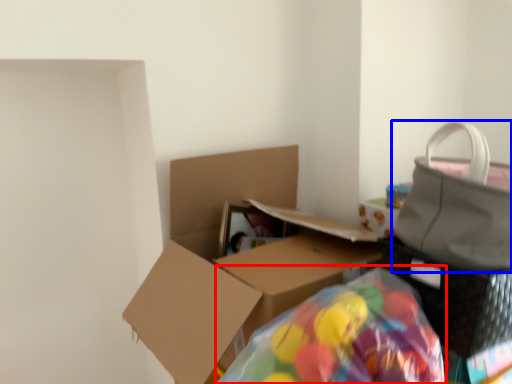
Question: Which object is closer to the camera taking this photo, bean bag chair (highlighted by a red box) or handbag (highlighted by a blue box)?

Choices:
 (A) bean bag chair
 (B) handbag

Answer: (A)